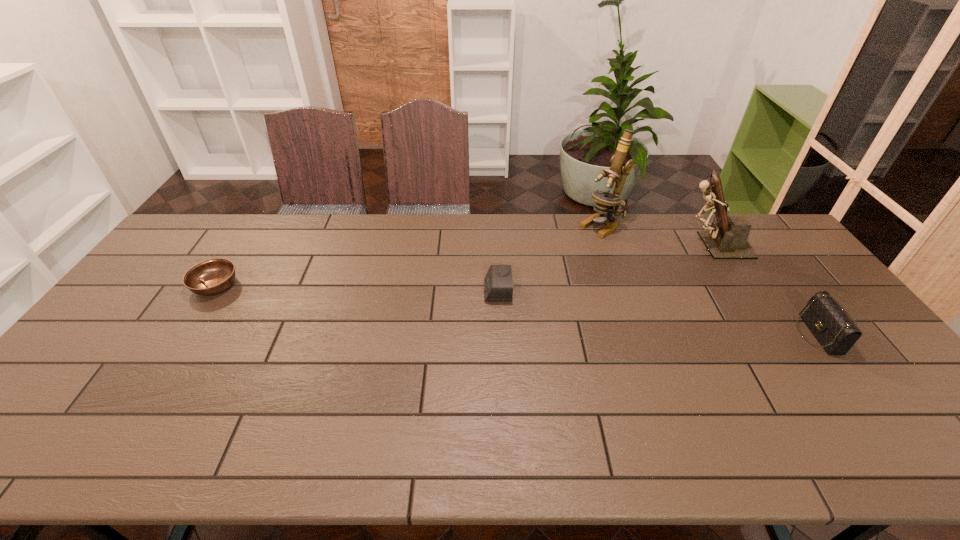
Where is `vacant position located on the front-facing side of the fourth shortest object`? This screenshot has width=960, height=540. vacant position located on the front-facing side of the fourth shortest object is located at coordinates 566,245.

The width and height of the screenshot is (960, 540). What are the coordinates of `vacant space located 0.160m on the front-facing side of the fourth shortest object` in the screenshot? It's located at (631, 245).

Locate an element on the screen. vacant space situated on the front-facing side of the fourth shortest object is located at coordinates (578, 245).

Where is `vacant position located on the front flap of the third shortest object`? The width and height of the screenshot is (960, 540). vacant position located on the front flap of the third shortest object is located at coordinates (728, 334).

Find the location of a particular element. This screenshot has height=540, width=960. vacant space situated 0.350m on the front flap of the third shortest object is located at coordinates pyautogui.click(x=673, y=334).

The width and height of the screenshot is (960, 540). What are the coordinates of `vacant region located on the front flap of the third shortest object` in the screenshot? It's located at (687, 334).

The image size is (960, 540). I want to click on free location located 0.350m on the front-facing side of the second object from left to right, so click(369, 291).

Where is `vacant region located 0.130m on the front-facing side of the second object from left to right`? The image size is (960, 540). vacant region located 0.130m on the front-facing side of the second object from left to right is located at coordinates (442, 291).

Where is `vacant point located on the front-facing side of the second object from left to right`? This screenshot has width=960, height=540. vacant point located on the front-facing side of the second object from left to right is located at coordinates (415, 291).

The height and width of the screenshot is (540, 960). Find the location of `vacant space located 0.060m on the front of the leftmost object`. vacant space located 0.060m on the front of the leftmost object is located at coordinates (195, 316).